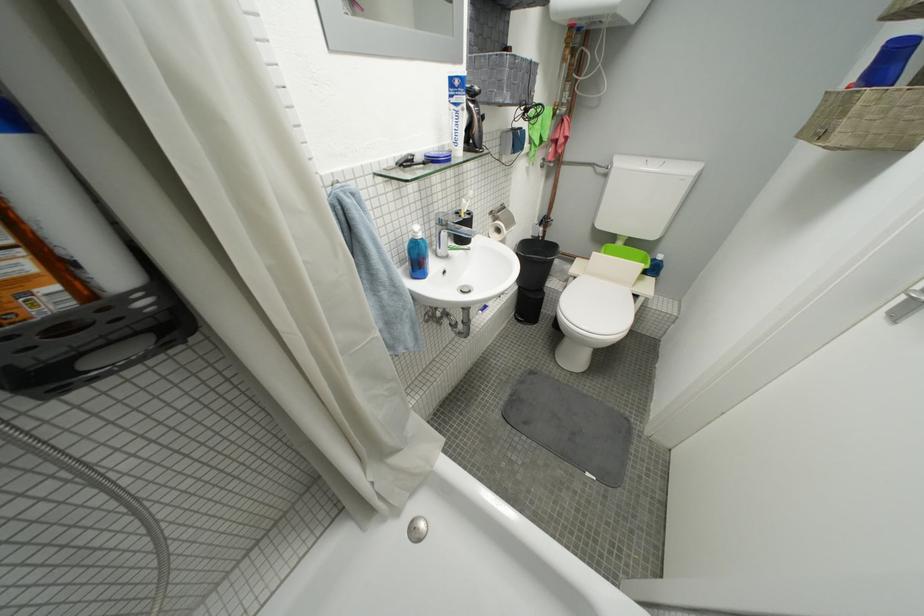
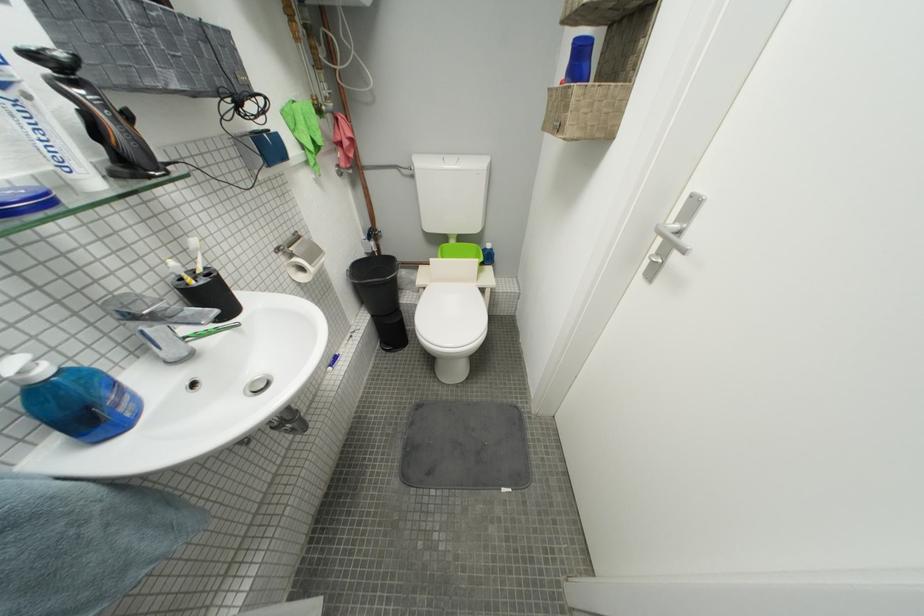
Question: The first image is from the beginning of the video and the second image is from the end. How did the camera likely rotate when shooting the video?

Choices:
 (A) Left
 (B) Right
 (C) Up
 (D) Down

Answer: (B)